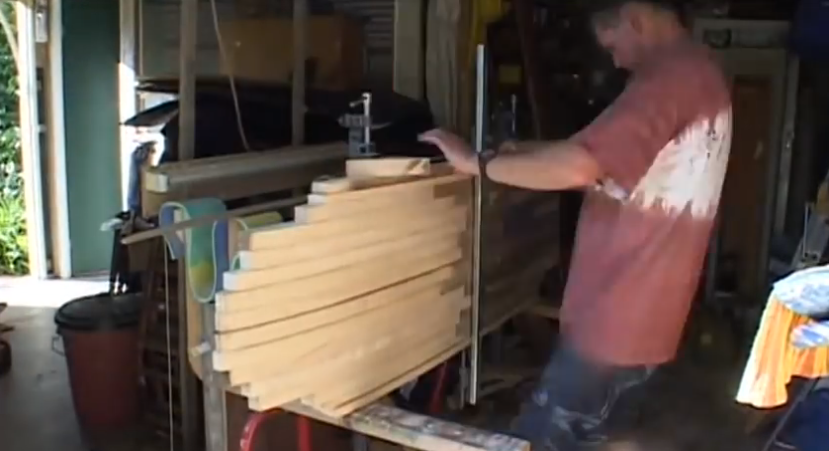
Locate an element on the screen. cabinet is located at coordinates (764, 124).